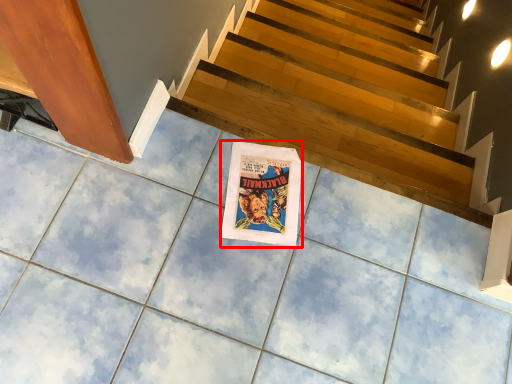
Question: From the image's perspective, what is the correct spatial positioning of movie poster (annotated by the red box) in reference to stairs?

Choices:
 (A) above
 (B) below

Answer: (B)